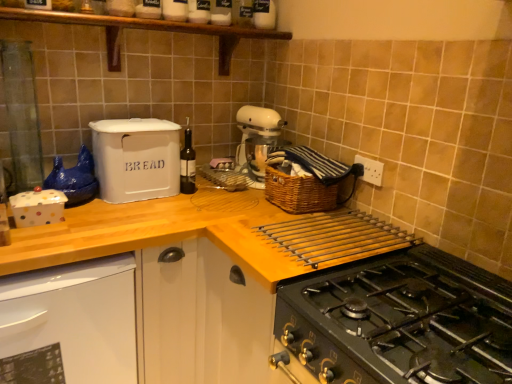
Question: From a real-world perspective, is wooden shelf at upper center above or below black matte gas stove at lower right?

Choices:
 (A) below
 (B) above

Answer: (B)

Question: Considering the positions of wooden shelf at upper center and black matte gas stove at lower right in the image, is wooden shelf at upper center wider or thinner than black matte gas stove at lower right?

Choices:
 (A) thin
 (B) wide

Answer: (A)

Question: Which object is the closest to the black matte gas stove at lower right?

Choices:
 (A) woven brown basket at upper right
 (B) white glossy dishwasher at lower left
 (C) white matte bread bin at upper left
 (D) dark glass bottle at center
 (E) wooden at upper center

Answer: (E)

Question: Which of these objects is positioned closest to the wooden shelf at upper center?

Choices:
 (A) wooden at upper center
 (B) white matte mixer at center
 (C) white matte bread bin at upper left
 (D) woven brown basket at upper right
 (E) dark glass bottle at center

Answer: (C)